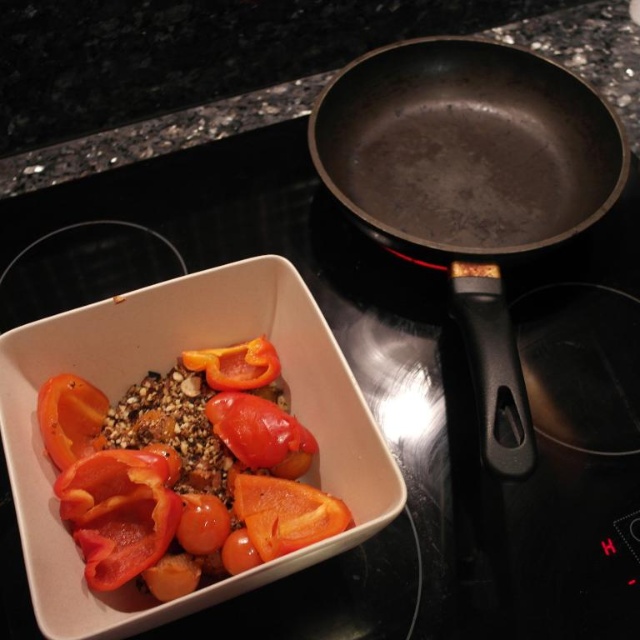
You are preparing a meal and have both the slightly translucent orange bell pepper at center and the sliced matte orange tomato at lower left on your countertop. Which ingredient should you use if you need a larger piece for your dish?

The slightly translucent orange bell pepper at center is larger in size than the sliced matte orange tomato at lower left, so you should use the slightly translucent orange bell pepper at center for your dish.

You are a chef preparing a dish and need to arrange the slightly translucent orange bell pepper at center and the glossy orange tomato at center on a plate. Based on their sizes, which one should you place first to ensure stability?

The slightly translucent orange bell pepper at center is taller than the glossy orange tomato at center, so you should place the bell pepper first to create a stable base for the tomato.